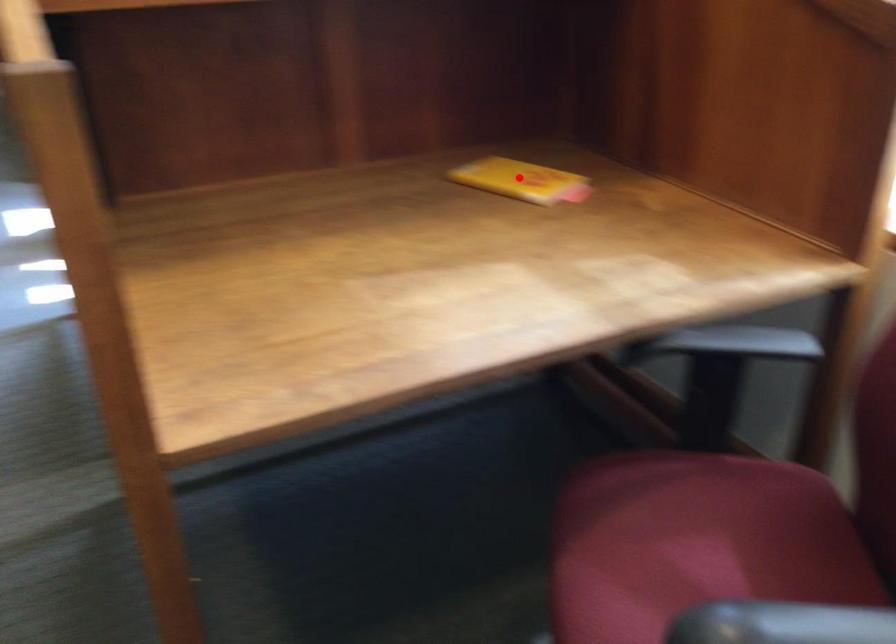
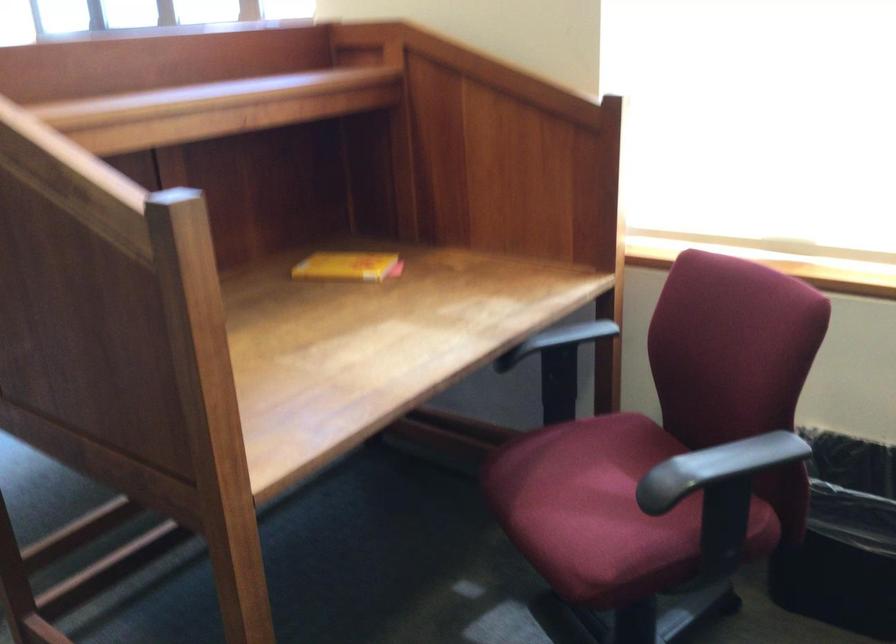
In the second image, find the point that corresponds to the highlighted location in the first image.

(348, 266)